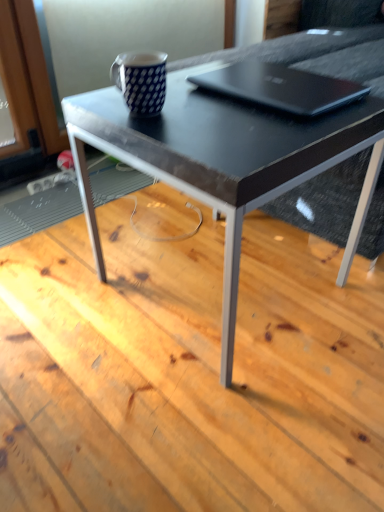
Locate an element on the screen. The width and height of the screenshot is (384, 512). free space in front of black matte laptop at upper center is located at coordinates (259, 131).